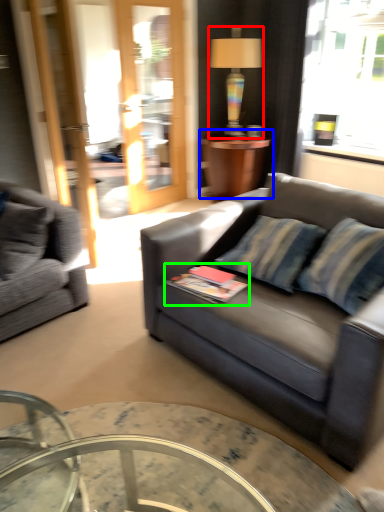
Question: Which object is the farthest from lamp (highlighted by a red box)? Choose among these: table (highlighted by a blue box) or book (highlighted by a green box).

Choices:
 (A) table
 (B) book

Answer: (B)